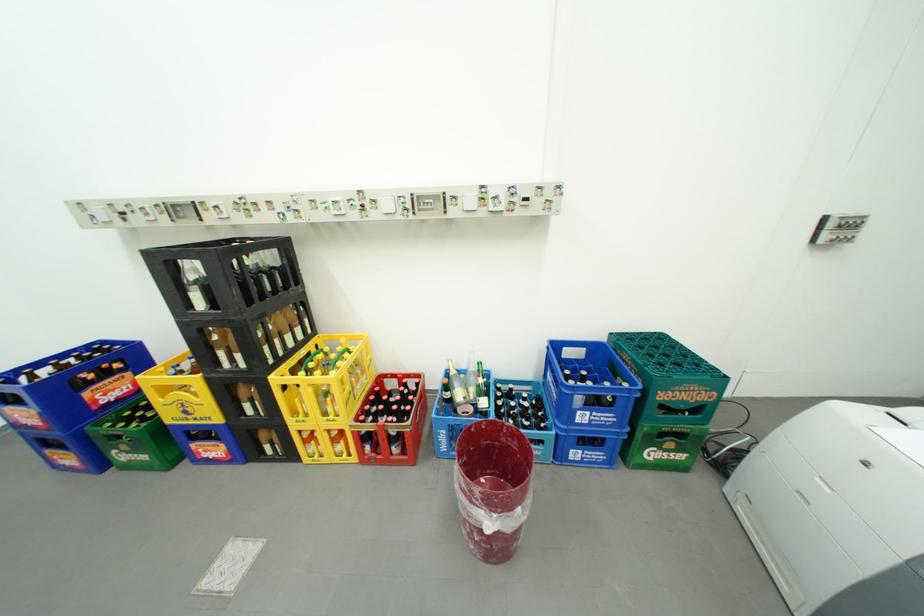
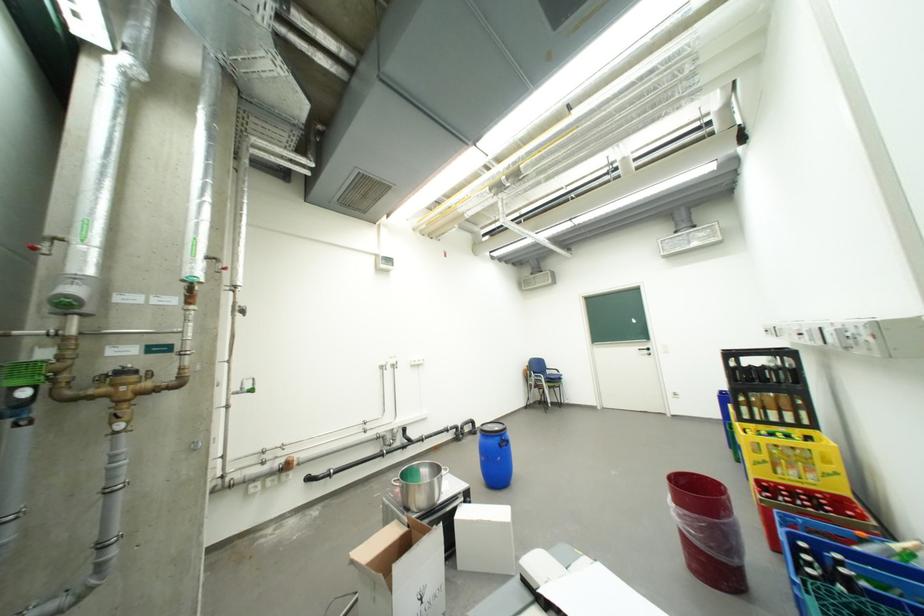
Where in the second image is the point corresponding to the point at 373,392 from the first image?

(810, 484)